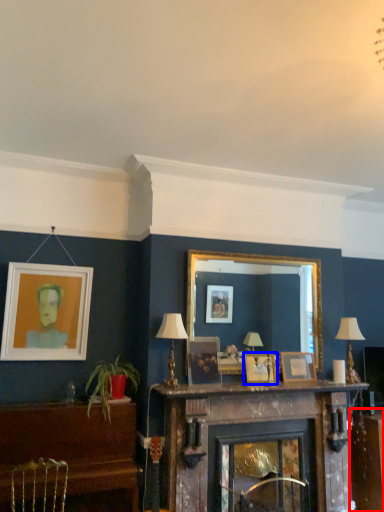
Question: Which point is further to the camera, table (highlighted by a red box) or picture frame (highlighted by a blue box)?

Choices:
 (A) table
 (B) picture frame

Answer: (A)